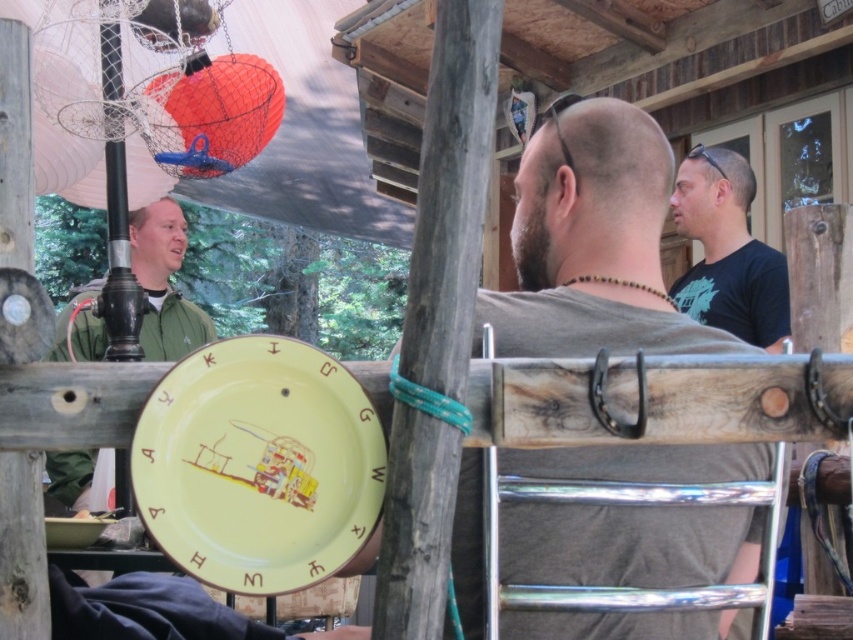
You are standing at the point with coordinates closest to the black lamp post with a decorative netted lantern. Which of the two points, point (263, 536) or point (55, 522), is closer to you?

Point (263, 536) is in front of point (55, 522), so it is closer to you.